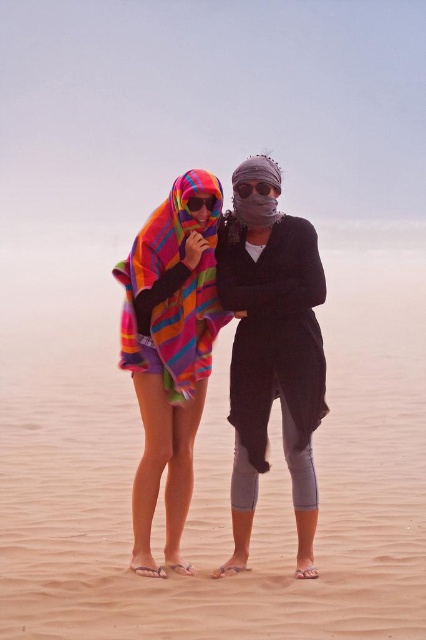
Question: Considering the relative positions of multicolored woven towel at center and multicolored woven blanket at center in the image provided, where is multicolored woven towel at center located with respect to multicolored woven blanket at center?

Choices:
 (A) left
 (B) right

Answer: (B)

Question: Which of the following is the farthest from the observer?

Choices:
 (A) multicolored woven towel at center
 (B) matte black goggles at center

Answer: (B)

Question: From the image, what is the correct spatial relationship of matte black goggles at center in relation to multicolored fabric goggles at center?

Choices:
 (A) below
 (B) above

Answer: (B)

Question: Which of these objects is positioned closest to the matte black goggles at center?

Choices:
 (A) multicolored woven blanket at center
 (B) multicolored woven towel at center

Answer: (A)

Question: Which object appears closest to the camera in this image?

Choices:
 (A) multicolored fabric goggles at center
 (B) multicolored woven blanket at center
 (C) matte black goggles at center
 (D) multicolored woven towel at center

Answer: (D)

Question: Is multicolored woven blanket at center to the right of matte black goggles at center from the viewer's perspective?

Choices:
 (A) no
 (B) yes

Answer: (A)